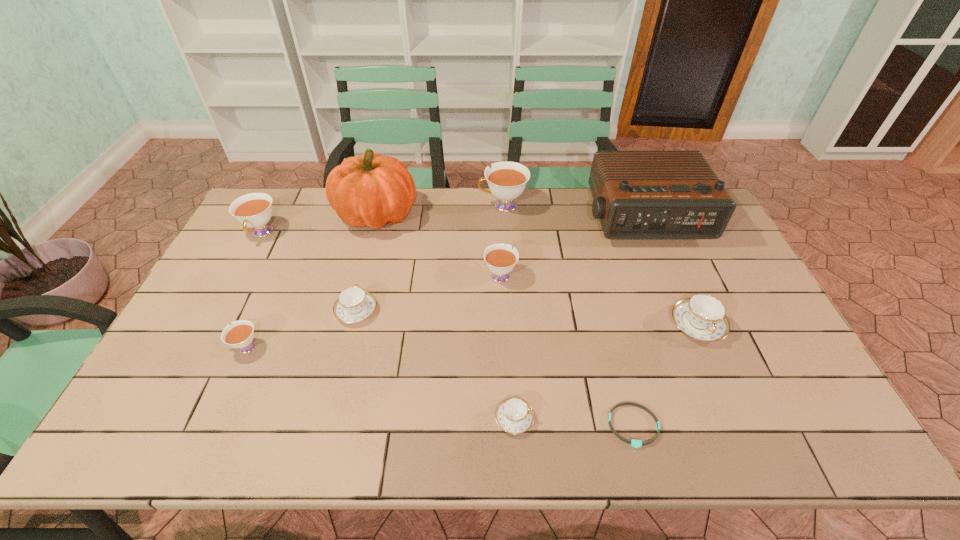
The height and width of the screenshot is (540, 960). I want to click on free space that is in between the fifth farthest object and the orange pumpkin, so click(x=439, y=245).

You are a GUI agent. You are given a task and a screenshot of the screen. Output one action in this format:
    pyautogui.click(x=<x>, y=<y>)
    Task: Click on the empty space that is in between the rightmost teacup and the smallest white teacup
    Image resolution: width=960 pixels, height=540 pixels.
    Given the screenshot: What is the action you would take?
    pyautogui.click(x=471, y=336)

The width and height of the screenshot is (960, 540). Find the location of `free space between the third teacup from left to right and the shortest teacup`. free space between the third teacup from left to right and the shortest teacup is located at coordinates (435, 365).

Where is `unoccupied area between the smallest white teacup and the wristband`? The width and height of the screenshot is (960, 540). unoccupied area between the smallest white teacup and the wristband is located at coordinates (439, 387).

In order to click on free space between the rightmost blue teacup and the third farthest teacup in this screenshot , I will do point(599,300).

Locate an element on the screen. The image size is (960, 540). free area in between the second object from left to right and the second shortest object is located at coordinates (380, 383).

Locate an element on the screen. The width and height of the screenshot is (960, 540). free spot between the second white teacup from left to right and the sixth shortest teacup is located at coordinates [x=253, y=290].

The width and height of the screenshot is (960, 540). Identify the location of blank region between the second object from left to right and the radio receiver. (444, 283).

Select which object appears as the sixth closest to the fifth farthest object. Please provide its 2D coordinates. Your answer should be formatted as a tuple, i.e. [(x, y)], where the tuple contains the x and y coordinates of a point satisfying the conditions above.

[(634, 443)]

Choose which object is the sixth nearest neighbor to the fifth nearest teacup. Please provide its 2D coordinates. Your answer should be formatted as a tuple, i.e. [(x, y)], where the tuple contains the x and y coordinates of a point satisfying the conditions above.

[(634, 443)]